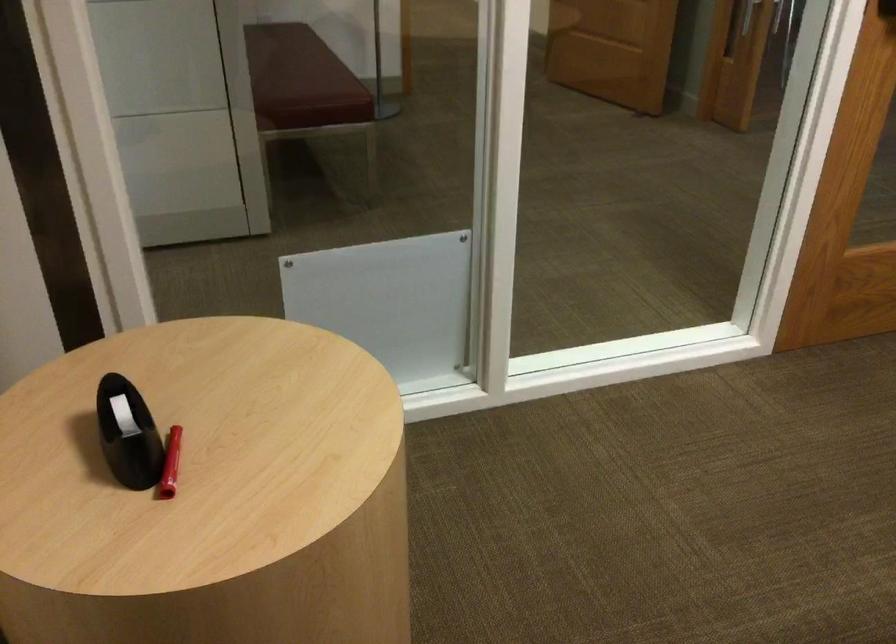
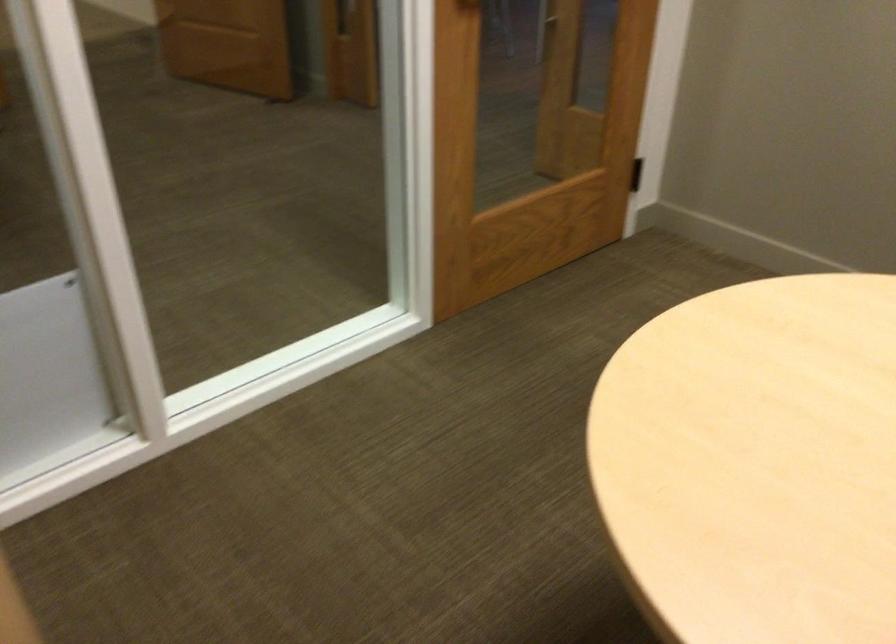
Question: Based on the continuous images, in which direction is the camera rotating? Reply with the corresponding letter.

Choices:
 (A) Left
 (B) Right
 (C) Up
 (D) Down

Answer: (B)